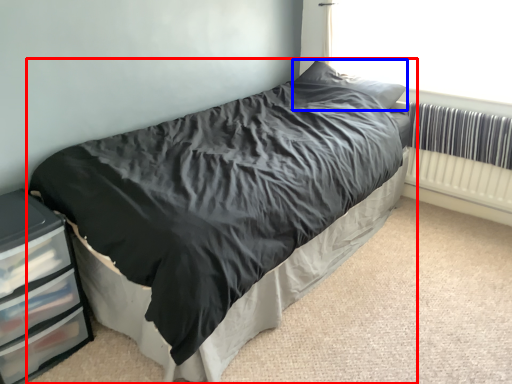
Question: Which object is further to the camera taking this photo, bed (highlighted by a red box) or pillow (highlighted by a blue box)?

Choices:
 (A) bed
 (B) pillow

Answer: (B)